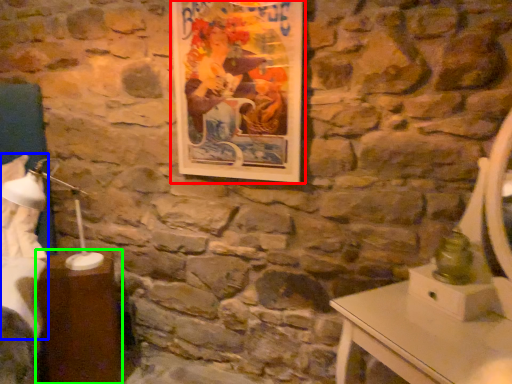
Question: Which object is the farthest from picture frame (highlighted by a red box)? Choose among these: sheet (highlighted by a blue box) or table (highlighted by a green box).

Choices:
 (A) sheet
 (B) table

Answer: (A)